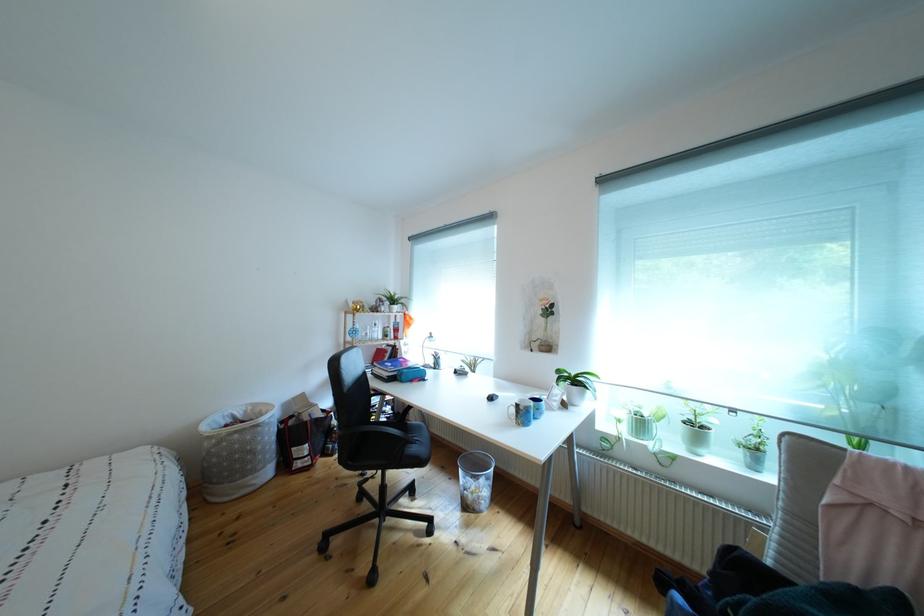
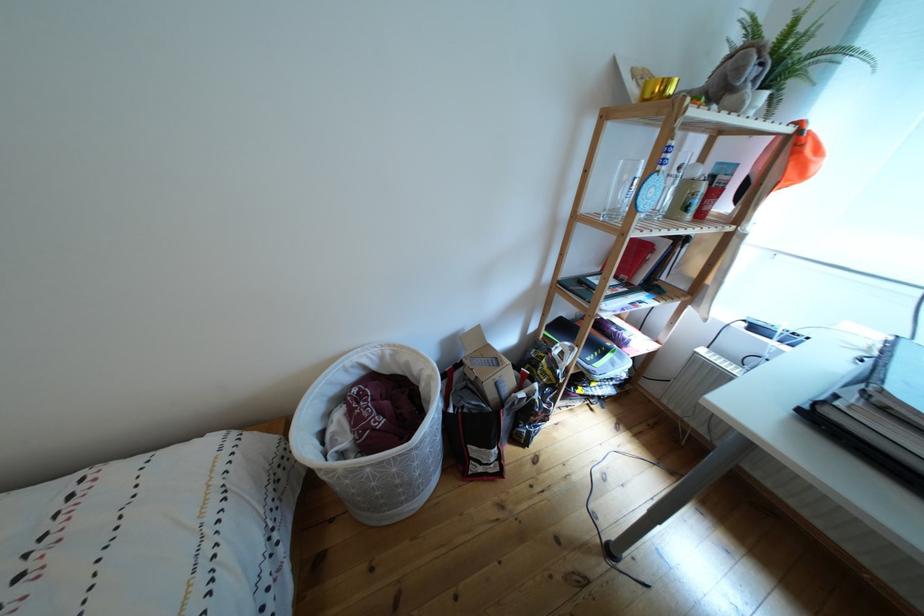
Where in the second image is the point corresponding to (x=257, y=418) from the first image?

(393, 363)